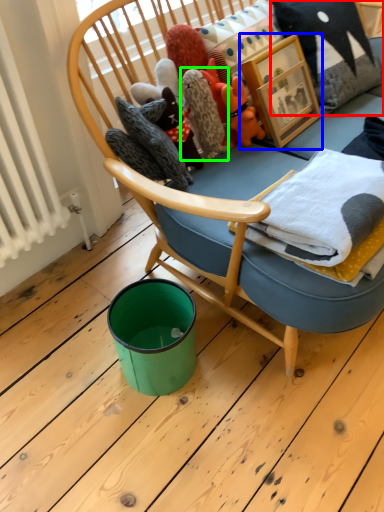
Question: Based on their relative distances, which object is nearer to pillow (highlighted by a red box)? Choose from picture frame (highlighted by a blue box) and cloth (highlighted by a green box).

Choices:
 (A) picture frame
 (B) cloth

Answer: (A)